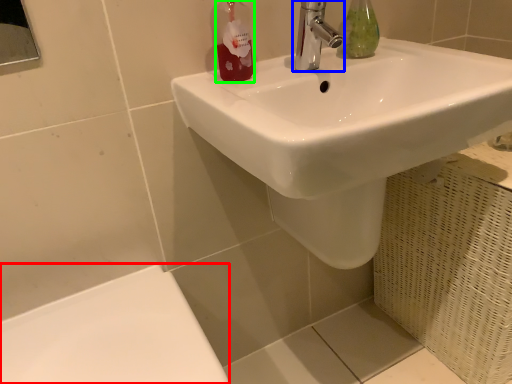
Question: Which is nearer to the porcelain (highlighted by a red box)? tap (highlighted by a blue box) or toiletry (highlighted by a green box).

Choices:
 (A) tap
 (B) toiletry

Answer: (B)